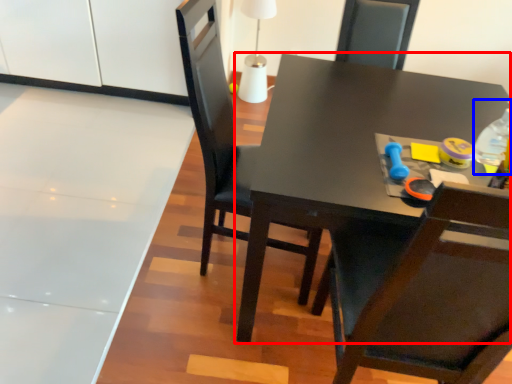
Question: Which object is closer to the camera taking this photo, table (highlighted by a red box) or bottle (highlighted by a blue box)?

Choices:
 (A) table
 (B) bottle

Answer: (A)